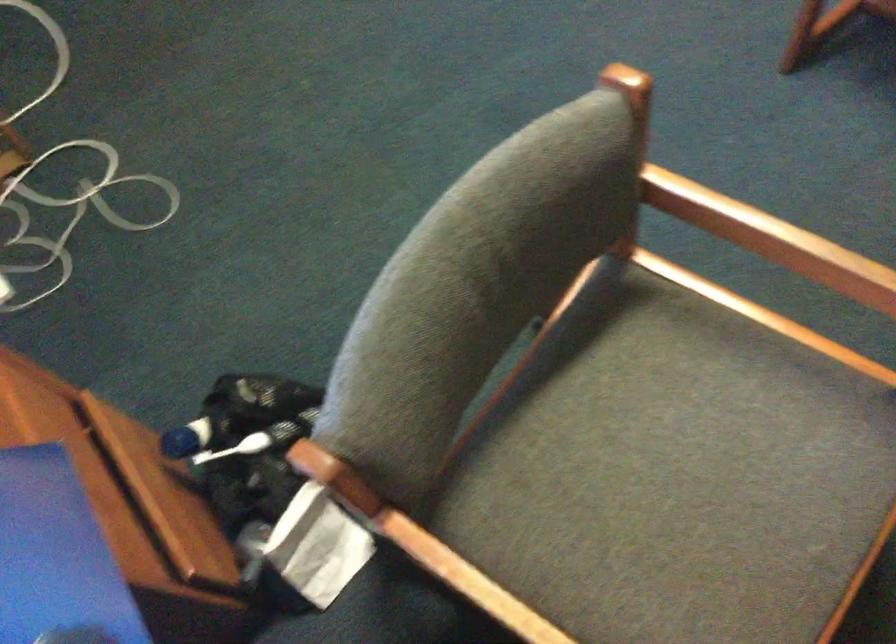
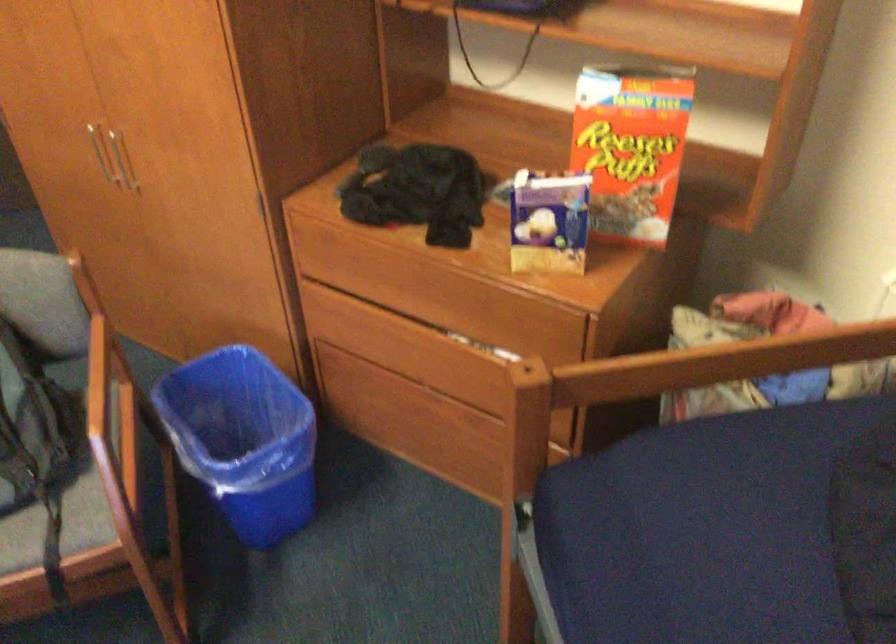
Question: How did the camera likely rotate?

Choices:
 (A) Left
 (B) Right
 (C) Up
 (D) Down

Answer: (B)